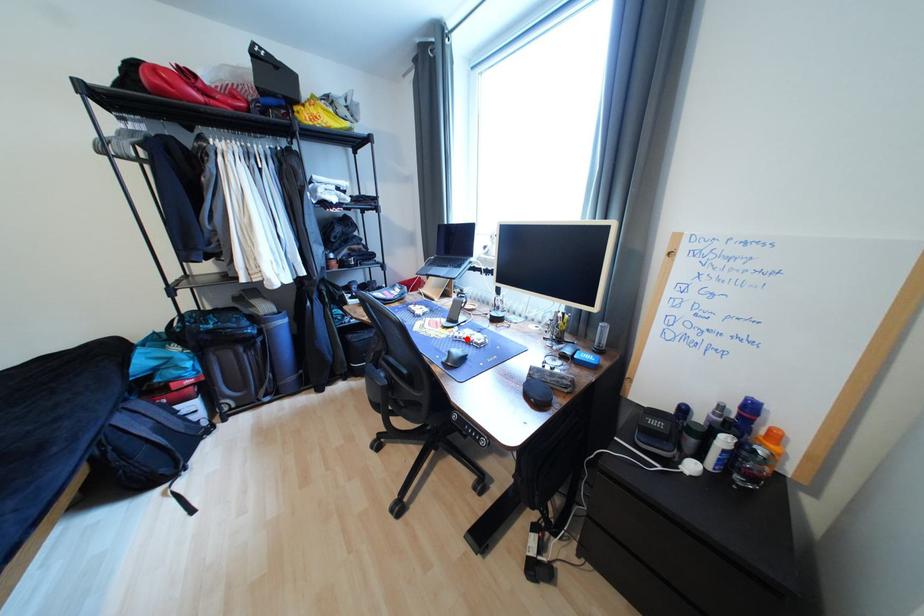
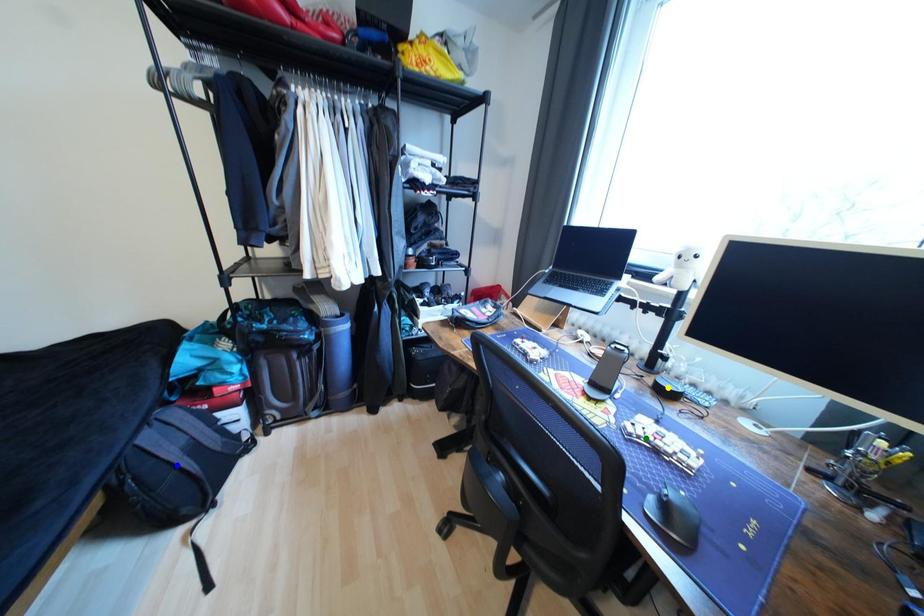
Question: I am providing you with two images of the same scene from different viewpoints. A red point is marked on the first image. You are given multiple points on the second image. Which point in image 2 represents the same 3d spot as the red point in image 1?

Choices:
 (A) blue point
 (B) yellow point
 (C) green point

Answer: (C)